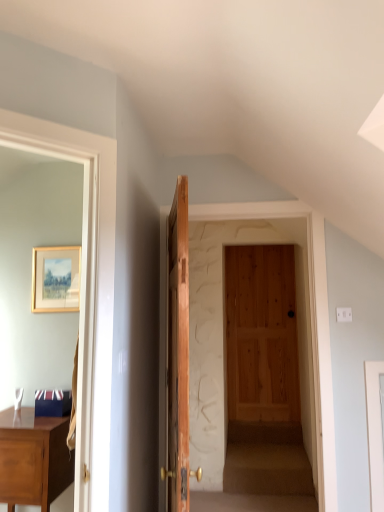
Question: Should I look upward or downward to see wooden door at center?

Choices:
 (A) down
 (B) up

Answer: (A)

Question: Is there a large distance between wooden door at center and wooden picture frame at upper left?

Choices:
 (A) yes
 (B) no

Answer: (B)

Question: Is the position of wooden door at center less distant than that of wooden picture frame at upper left?

Choices:
 (A) yes
 (B) no

Answer: (A)

Question: Can you confirm if wooden door at center is thinner than wooden picture frame at upper left?

Choices:
 (A) yes
 (B) no

Answer: (B)

Question: Considering the relative positions of wooden door at center and wooden picture frame at upper left in the image provided, is wooden door at center to the left of wooden picture frame at upper left from the viewer's perspective?

Choices:
 (A) no
 (B) yes

Answer: (A)

Question: Is wooden door at center positioned with its back to wooden picture frame at upper left?

Choices:
 (A) yes
 (B) no

Answer: (A)

Question: Is wooden door at center oriented towards wooden picture frame at upper left?

Choices:
 (A) yes
 (B) no

Answer: (B)

Question: Considering the relative positions of matte brown desk at left and wooden door at center in the image provided, is matte brown desk at left to the right of wooden door at center from the viewer's perspective?

Choices:
 (A) yes
 (B) no

Answer: (B)

Question: Is matte brown desk at left beside wooden door at center?

Choices:
 (A) no
 (B) yes

Answer: (A)

Question: Could wooden door at center be considered to be inside matte brown desk at left?

Choices:
 (A) yes
 (B) no

Answer: (B)

Question: From the image's perspective, is matte brown desk at left on top of wooden door at center?

Choices:
 (A) no
 (B) yes

Answer: (A)

Question: Is matte brown desk at left shorter than wooden door at center?

Choices:
 (A) no
 (B) yes

Answer: (B)

Question: Is matte brown desk at left not close to wooden door at center?

Choices:
 (A) no
 (B) yes

Answer: (A)

Question: From the image's perspective, does wooden picture frame at upper left appear lower than matte brown desk at left?

Choices:
 (A) no
 (B) yes

Answer: (A)